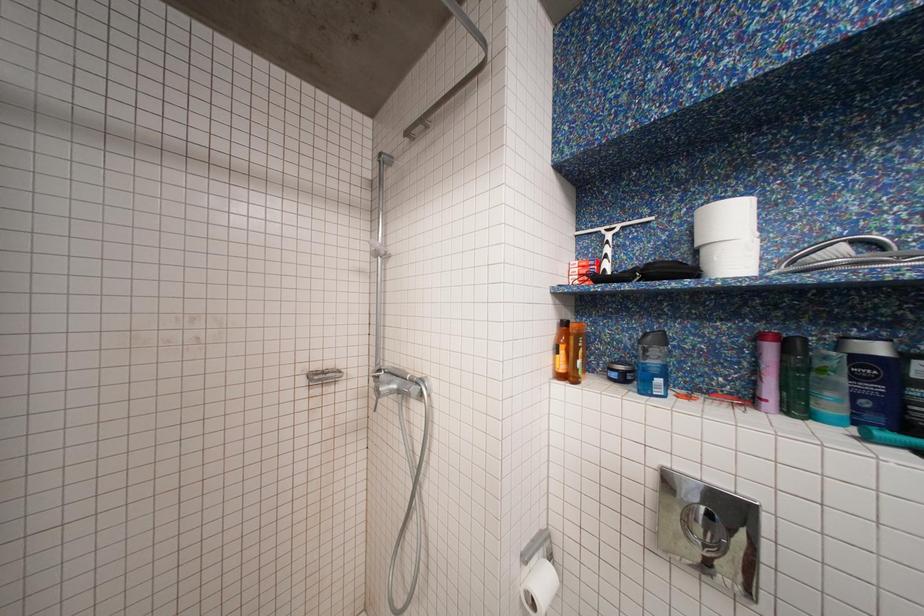
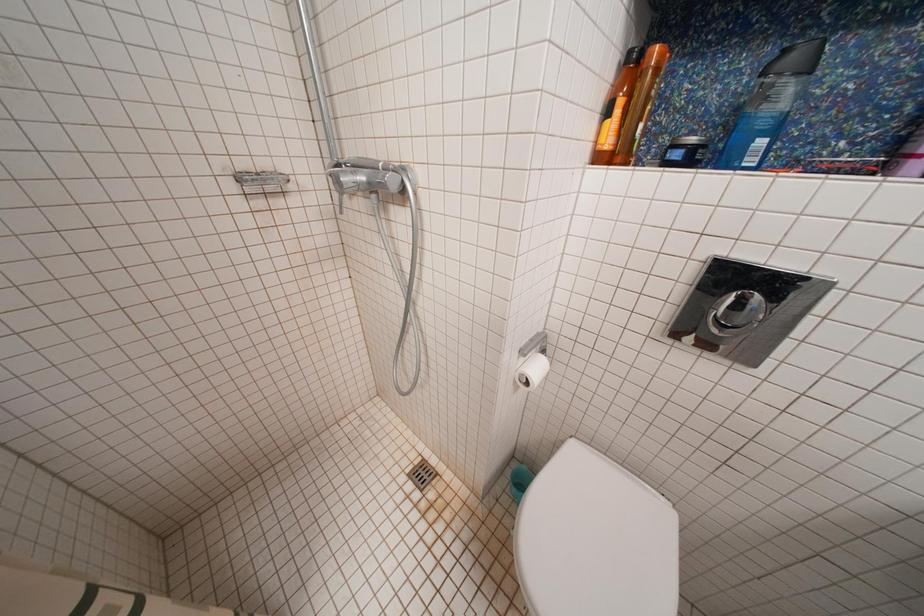
Question: The first image is from the beginning of the video and the second image is from the end. How did the camera likely rotate when shooting the video?

Choices:
 (A) Left
 (B) Right
 (C) Up
 (D) Down

Answer: (D)